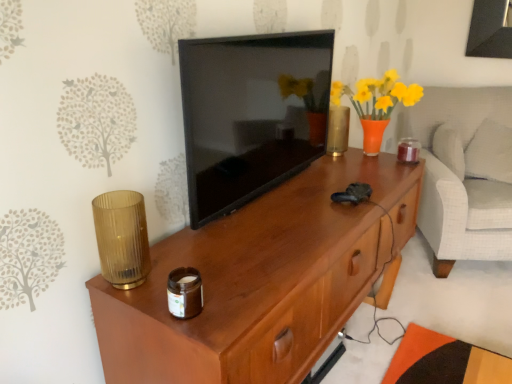
The image size is (512, 384). In order to click on unoccupied space behind brown glass jar at lower center, the 2th candle holder when ordered from right to left in this screenshot , I will do `click(202, 265)`.